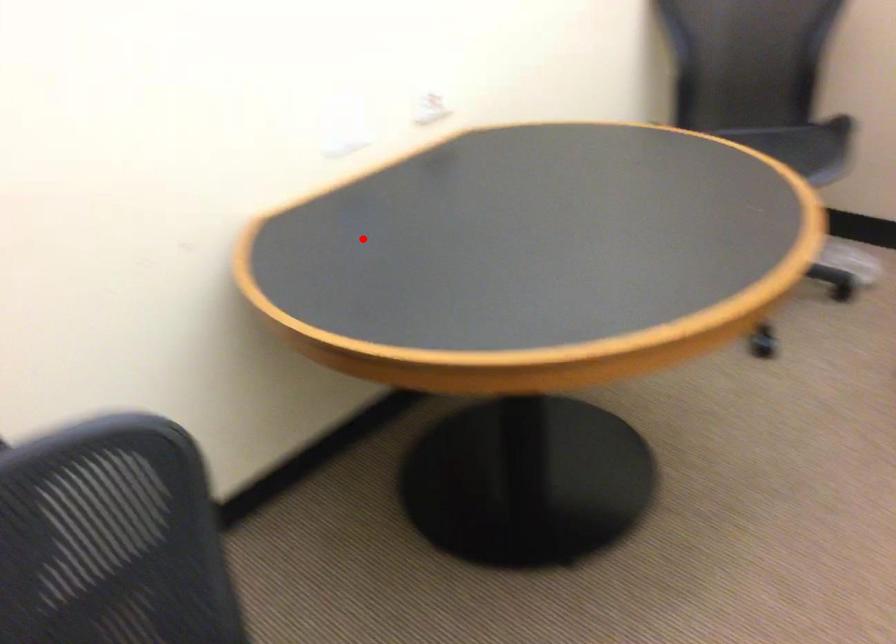
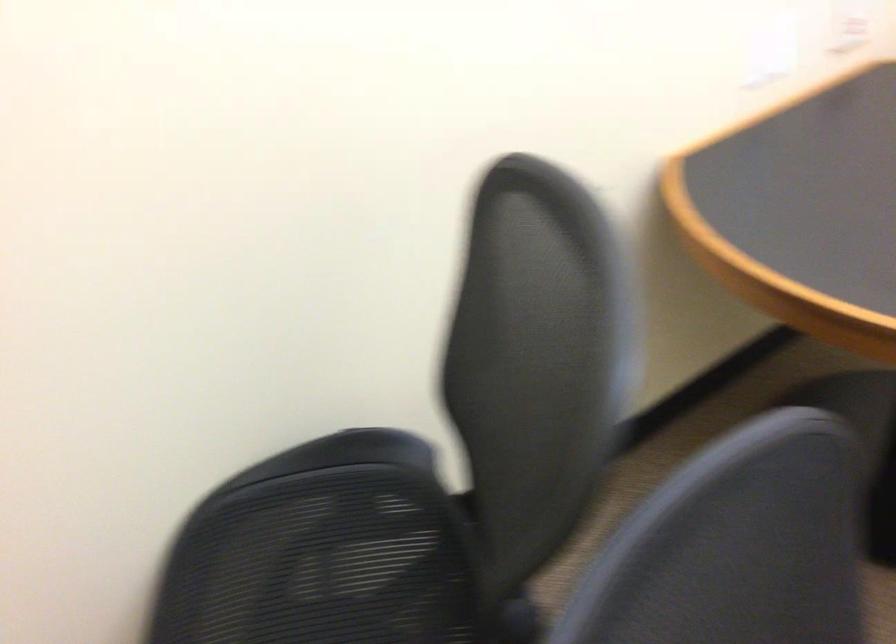
Find the pixel in the second image that matches the highlighted location in the first image.

(812, 190)